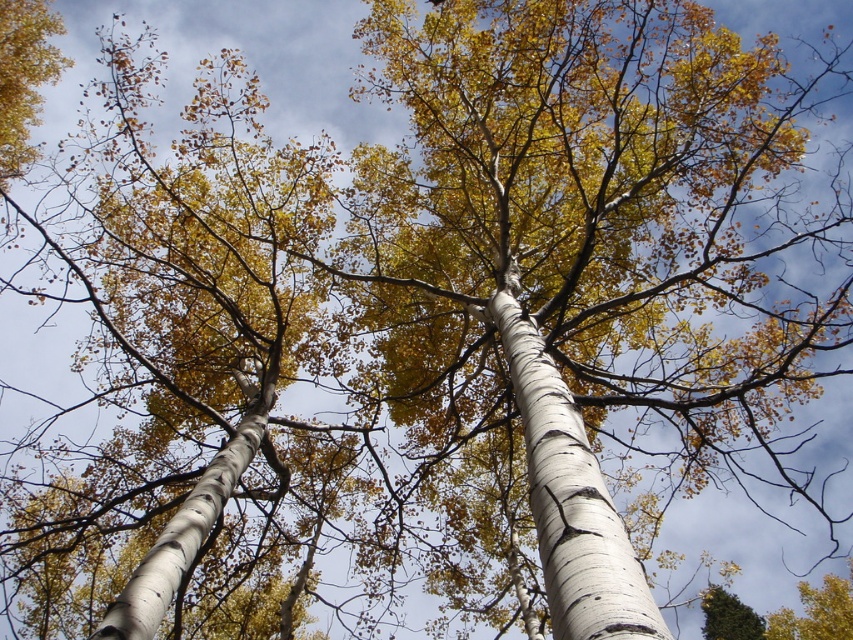
Is white bark birch tree at center thinner than white bark tree at center?

Indeed, white bark birch tree at center has a lesser width compared to white bark tree at center.

What do you see at coordinates (596, 256) in the screenshot? I see `white bark birch tree at center` at bounding box center [596, 256].

Between point (596, 438) and point (50, 422), which one is positioned in front?

Point (50, 422)

Locate an element on the screen. This screenshot has width=853, height=640. white bark birch tree at center is located at coordinates (596, 256).